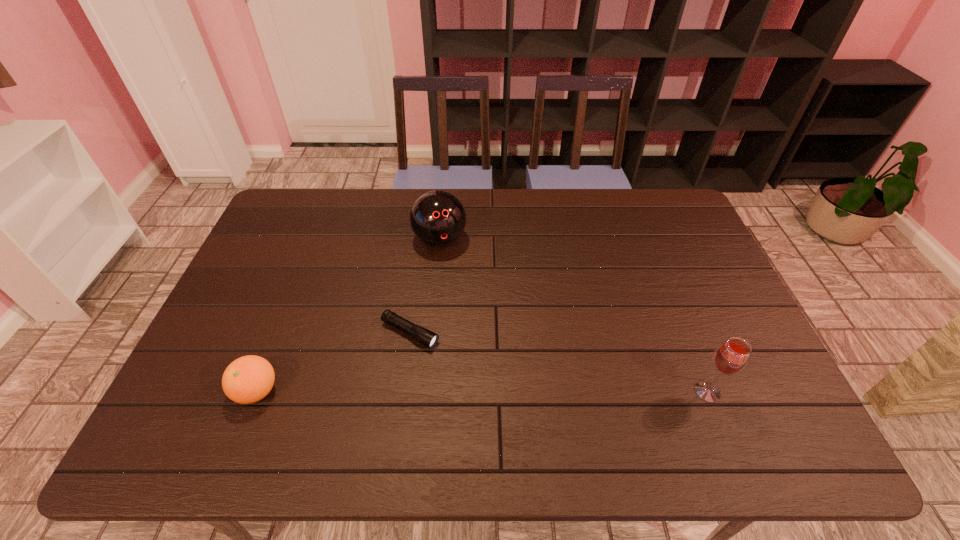
The image size is (960, 540). I want to click on vacant space on the desktop that is between the second shortest object and the rightmost object and is positioned on the surface of the farthest object near the finger holes, so click(490, 392).

In order to click on vacant spot on the desktop that is between the leftmost object and the wineglass and is positioned at the lens end of the flashlight in this screenshot , I will do `click(516, 392)`.